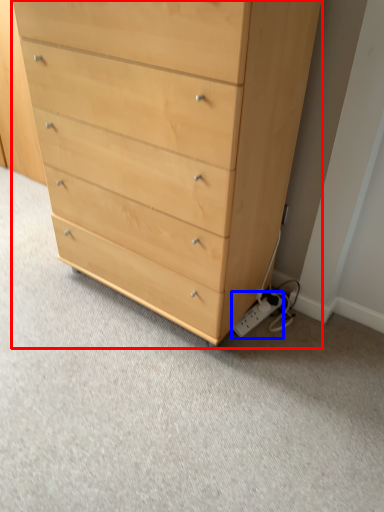
Question: Which point is further to the camera, chest of drawers (highlighted by a red box) or electric outlet (highlighted by a blue box)?

Choices:
 (A) chest of drawers
 (B) electric outlet

Answer: (B)